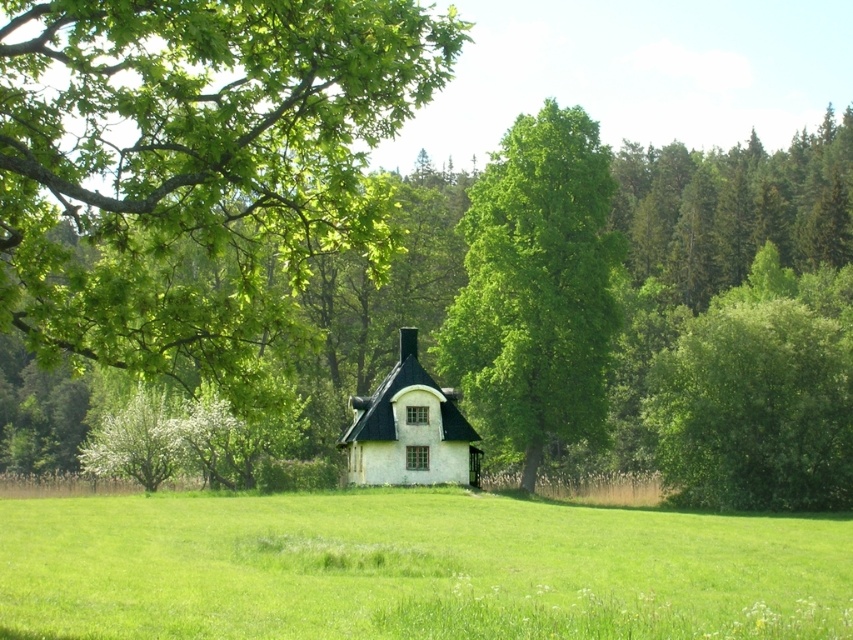
Question: Can you confirm if green grassy field at center is wider than white matte cottage at center?

Choices:
 (A) yes
 (B) no

Answer: (A)

Question: Which of the following is the closest to the observer?

Choices:
 (A) white matte cottage at center
 (B) green leafy tree at center

Answer: (A)

Question: Considering the relative positions of green grassy field at center and green leafy tree at center in the image provided, where is green grassy field at center located with respect to green leafy tree at center?

Choices:
 (A) above
 (B) below

Answer: (B)

Question: Which point is closer to the camera?

Choices:
 (A) green leafy tree at center
 (B) green grassy field at center
 (C) white matte cottage at center

Answer: (B)

Question: Can you confirm if green leafy tree at center is smaller than white matte cottage at center?

Choices:
 (A) yes
 (B) no

Answer: (B)

Question: Which object is positioned closest to the green grassy field at center?

Choices:
 (A) green leafy tree at center
 (B) white matte cottage at center

Answer: (B)